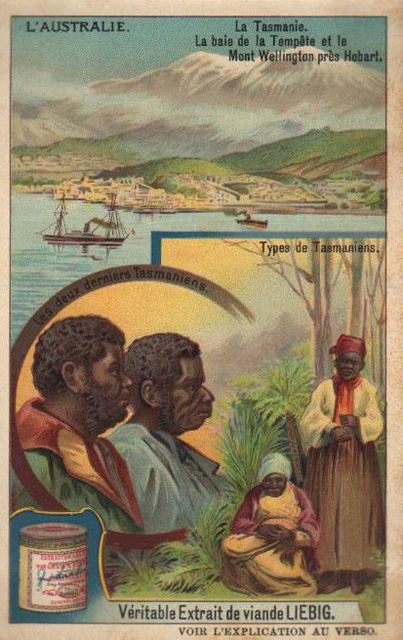
Based on the scene described, which ship is closer to the viewer, the wooden ship at upper left or the wooden ship at upper center?

The wooden ship at upper left is closer to the viewer because it is positioned in front of the wooden ship at upper center.